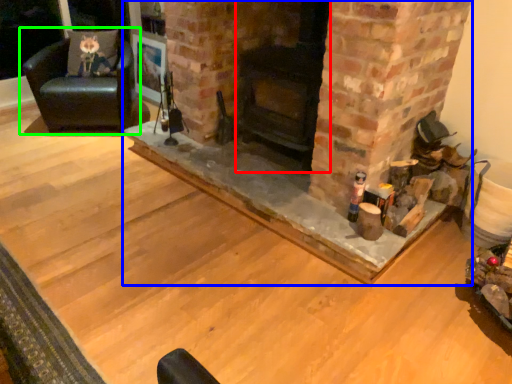
Question: Considering the real-world distances, which object is farthest from fireplace (highlighted by a red box)? fireplace (highlighted by a blue box) or chair (highlighted by a green box)?

Choices:
 (A) fireplace
 (B) chair

Answer: (B)